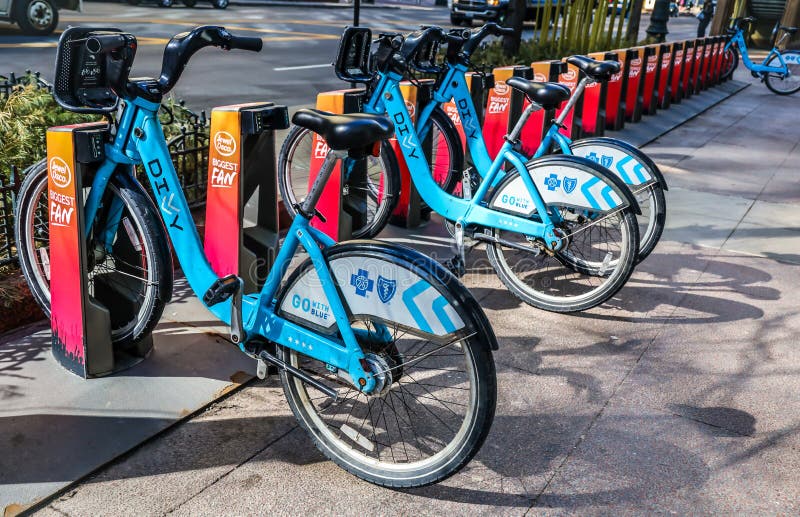
Find the location of a particular element. This screenshot has width=800, height=517. seats is located at coordinates (328, 129), (544, 97), (590, 72), (613, 66), (794, 33).